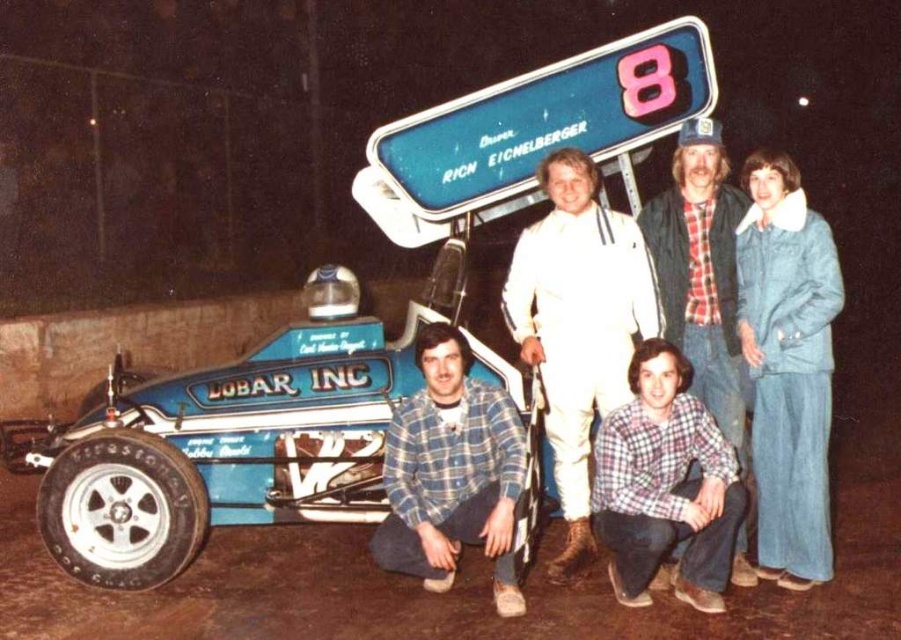
You are a photographer standing in front of the blue metallic racecar at lower left and the blue plastic sign at upper center. Which object is closer to the right side of the image?

The blue plastic sign at upper center is closer to the right side of the image because the blue metallic racecar at lower left is to the left of it.

You are a photographer standing in front of the blue metallic racecar at lower left and the white smooth suit at center. Which object is nearer to you?

The blue metallic racecar at lower left is closer to the viewer than the white smooth suit at center.